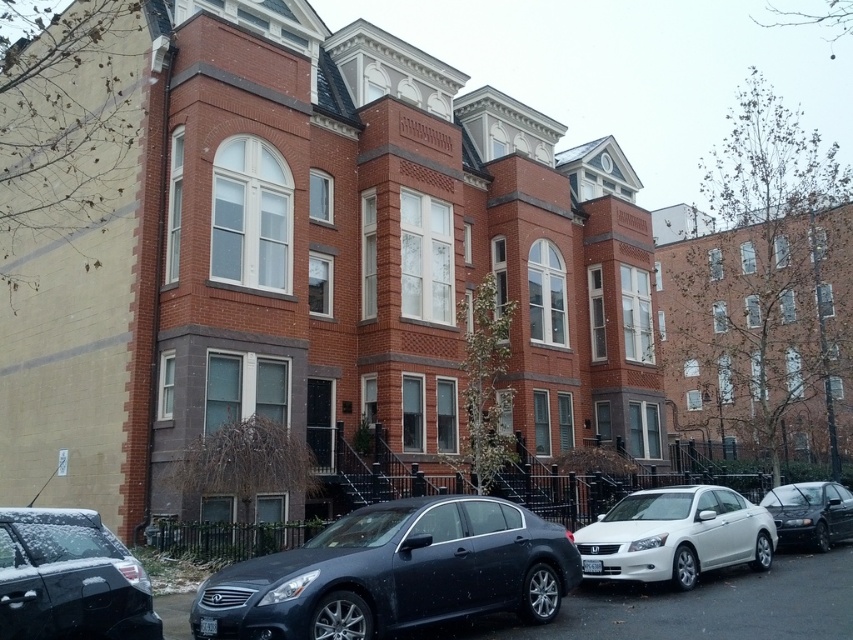
Can you confirm if satin black sedan at center is positioned above shiny black sedan at center?

Yes.

Who is lower down, satin black sedan at center or shiny black sedan at center?

shiny black sedan at center is lower down.

What are the coordinates of `satin black sedan at center` in the screenshot? It's located at (395, 573).

Between satin black sedan at center and shiny black sedan at lower left, which one has more height?

satin black sedan at center is taller.

Who is more forward, (253,588) or (68,552)?

Positioned in front is point (68,552).

Between point (412, 572) and point (119, 550), which one is positioned in front?

Point (119, 550) is more forward.

Where is `satin black sedan at center`? This screenshot has width=853, height=640. satin black sedan at center is located at coordinates (395, 573).

Who is more distant from viewer, (592, 570) or (814, 515)?

The point (814, 515) is more distant.

Does white glossy sedan at center have a greater width compared to shiny black sedan at center?

Yes.

Between point (746, 502) and point (787, 531), which one is positioned behind?

The point (787, 531) is behind.

The width and height of the screenshot is (853, 640). I want to click on white glossy sedan at center, so click(676, 536).